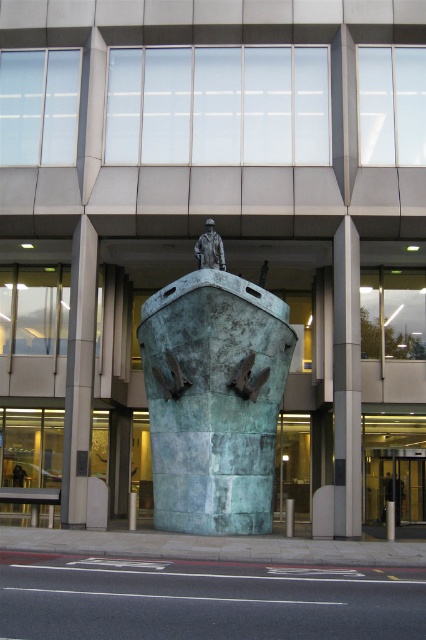
Question: Which point is closer to the camera taking this photo?

Choices:
 (A) (357, 339)
 (B) (89, 289)
 (C) (204, 244)

Answer: (C)

Question: Among these objects, which one is nearest to the camera?

Choices:
 (A) bronze statue at center
 (B) smooth gray pillar at center
 (C) green patina ship at center
 (D) green patina pillar at center

Answer: (C)

Question: Which object is the closest to the green patina ship at center?

Choices:
 (A) green patina pillar at center
 (B) smooth gray pillar at center
 (C) bronze statue at center

Answer: (A)

Question: Does green patina ship at center have a greater width compared to smooth gray pillar at center?

Choices:
 (A) yes
 (B) no

Answer: (A)

Question: Can you confirm if smooth gray pillar at center is wider than green patina pillar at center?

Choices:
 (A) yes
 (B) no

Answer: (B)

Question: Does smooth gray pillar at center appear under green patina pillar at center?

Choices:
 (A) no
 (B) yes

Answer: (A)